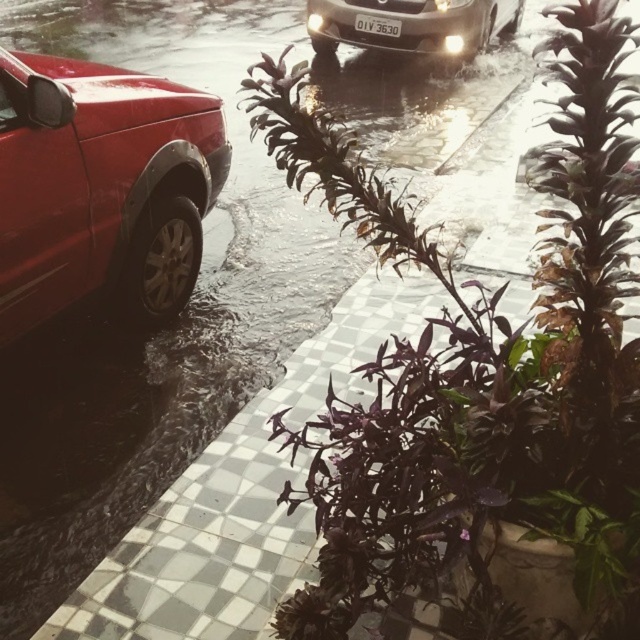
Question: Is purple matte plant at center behind sleek silver sedan at upper center?

Choices:
 (A) no
 (B) yes

Answer: (A)

Question: Is sleek silver sedan at upper center to the right of white plastic license plate at center from the viewer's perspective?

Choices:
 (A) yes
 (B) no

Answer: (A)

Question: Which point is farther to the camera?

Choices:
 (A) white plastic license plate at center
 (B) matte red car at left
 (C) sleek silver sedan at upper center
 (D) purple matte plant at center

Answer: (A)

Question: Based on their relative distances, which object is farther from the purple matte plant at center?

Choices:
 (A) sleek silver sedan at upper center
 (B) white plastic license plate at center
 (C) matte red car at left

Answer: (A)

Question: Estimate the real-world distances between objects in this image. Which object is closer to the matte red car at left?

Choices:
 (A) sleek silver sedan at upper center
 (B) white plastic license plate at center
 (C) purple matte plant at center

Answer: (C)

Question: Can you confirm if matte red car at left is positioned to the right of sleek silver sedan at upper center?

Choices:
 (A) yes
 (B) no

Answer: (B)